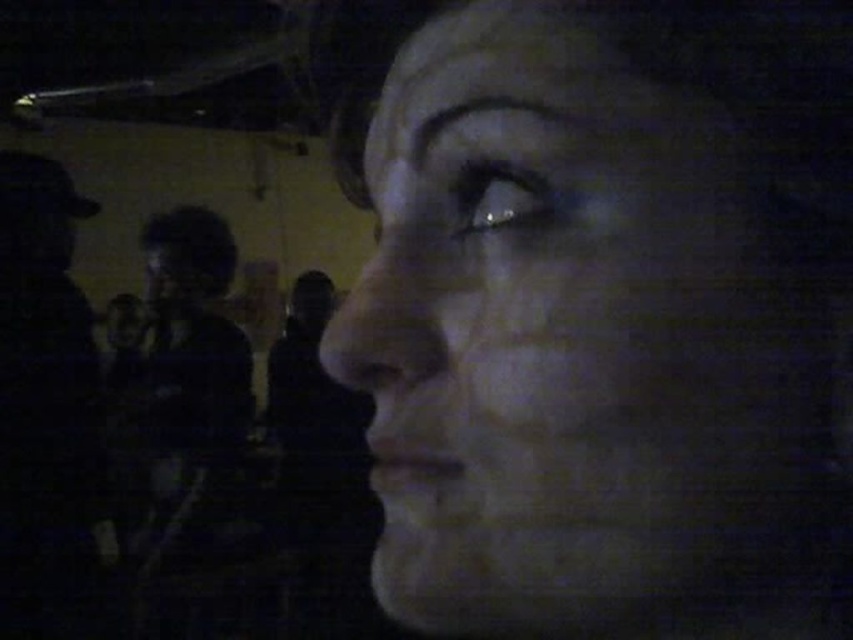
Question: Does dark matte jacket at left appear under dark gray fabric shirt at left?

Choices:
 (A) yes
 (B) no

Answer: (A)

Question: Which of the following is the closest to the observer?

Choices:
 (A) (722, 177)
 (B) (21, 227)

Answer: (A)

Question: Which point is farther to the camera?

Choices:
 (A) (137, 609)
 (B) (32, 364)

Answer: (A)

Question: Is smooth stone face at center positioned in front of dark matte jacket at left?

Choices:
 (A) no
 (B) yes

Answer: (B)

Question: Which point is farther from the camera taking this photo?

Choices:
 (A) (612, 570)
 (B) (173, 221)

Answer: (B)

Question: Is dark matte jacket at left positioned behind dark gray fabric shirt at left?

Choices:
 (A) no
 (B) yes

Answer: (A)